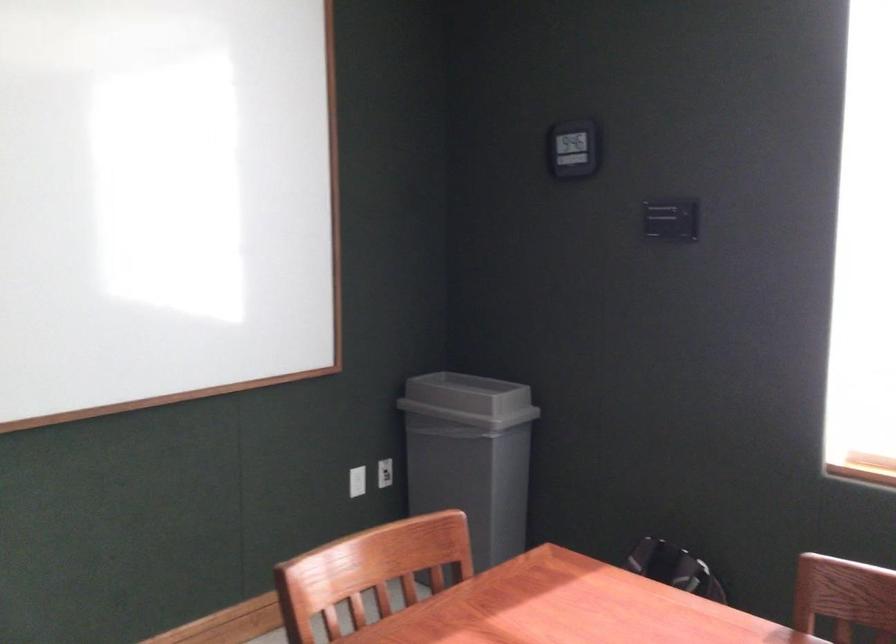
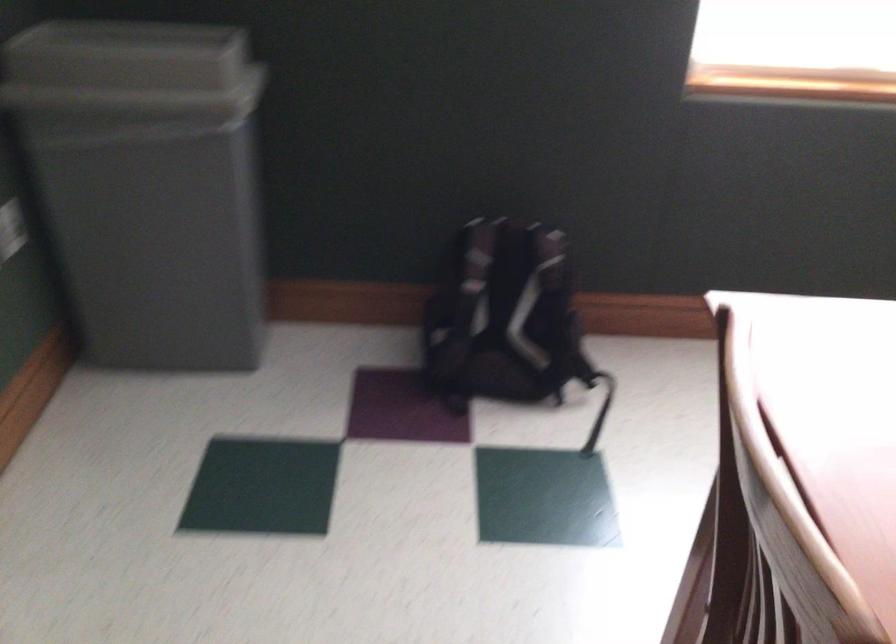
Locate, in the second image, the point that corresponds to (446,399) in the first image.

(131, 71)